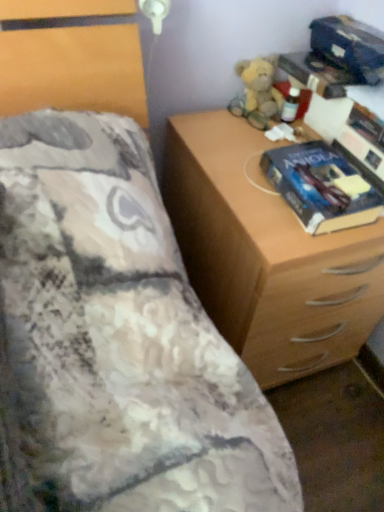
Question: Can you confirm if wooden chest of drawers at right is thinner than blue glossy paperback book at right?

Choices:
 (A) yes
 (B) no

Answer: (B)

Question: Is wooden chest of drawers at right positioned before blue glossy paperback book at right?

Choices:
 (A) yes
 (B) no

Answer: (A)

Question: Does wooden chest of drawers at right have a lesser height compared to blue glossy paperback book at right?

Choices:
 (A) yes
 (B) no

Answer: (B)

Question: Is the depth of wooden chest of drawers at right greater than that of blue glossy paperback book at right?

Choices:
 (A) yes
 (B) no

Answer: (B)

Question: Is wooden chest of drawers at right oriented towards blue glossy paperback book at right?

Choices:
 (A) yes
 (B) no

Answer: (B)

Question: In the image, is fluffy beige teddy bear at upper right positioned in front of or behind blue glossy paperback book at right?

Choices:
 (A) front
 (B) behind

Answer: (B)

Question: In terms of width, does fluffy beige teddy bear at upper right look wider or thinner when compared to blue glossy paperback book at right?

Choices:
 (A) wide
 (B) thin

Answer: (B)

Question: From a real-world perspective, relative to blue glossy paperback book at right, is fluffy beige teddy bear at upper right vertically above or below?

Choices:
 (A) above
 (B) below

Answer: (A)

Question: Which is correct: fluffy beige teddy bear at upper right is inside blue glossy paperback book at right, or outside of it?

Choices:
 (A) outside
 (B) inside

Answer: (A)

Question: Do you think wooden chest of drawers at right is within blue glossy paperback book at right, or outside of it?

Choices:
 (A) outside
 (B) inside

Answer: (A)

Question: Is wooden chest of drawers at right wider or thinner than blue glossy paperback book at right?

Choices:
 (A) thin
 (B) wide

Answer: (B)

Question: Looking at the image, does wooden chest of drawers at right seem bigger or smaller compared to blue glossy paperback book at right?

Choices:
 (A) big
 (B) small

Answer: (A)

Question: Is wooden chest of drawers at right taller or shorter than blue glossy paperback book at right?

Choices:
 (A) tall
 (B) short

Answer: (A)

Question: From a real-world perspective, is wooden chest of drawers at right positioned above or below fluffy beige teddy bear at upper right?

Choices:
 (A) below
 (B) above

Answer: (A)

Question: In the image, is wooden chest of drawers at right positioned in front of or behind fluffy beige teddy bear at upper right?

Choices:
 (A) behind
 (B) front

Answer: (B)